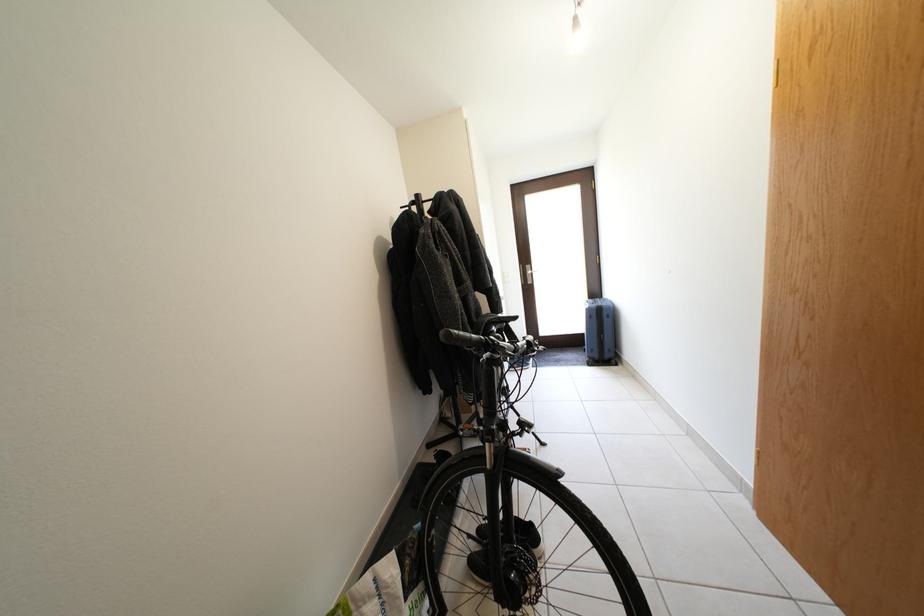
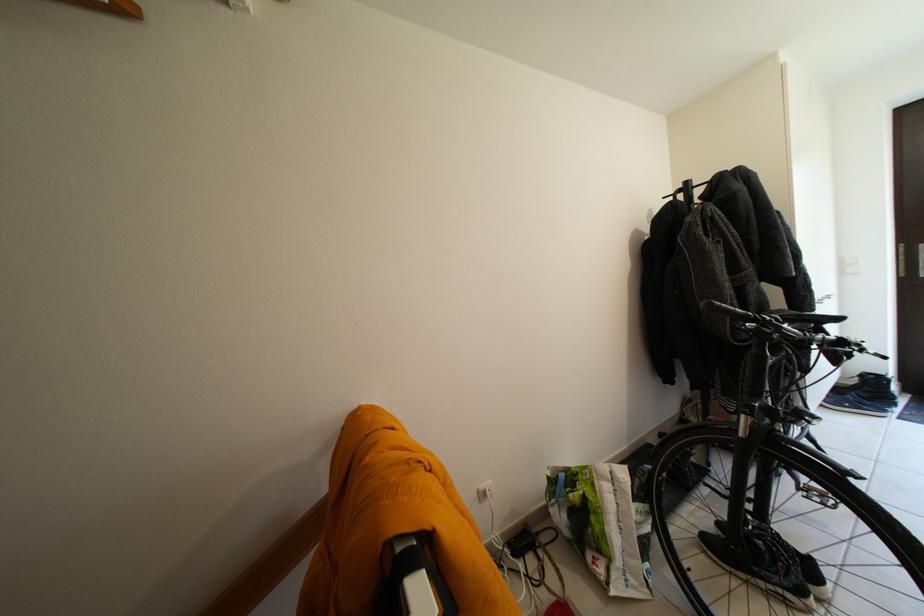
Question: The camera is either moving clockwise (left) or counter-clockwise (right) around the object. The first image is from the beginning of the video and the second image is from the end. Is the camera moving left or right when shooting the video?

Choices:
 (A) Left
 (B) Right

Answer: (B)